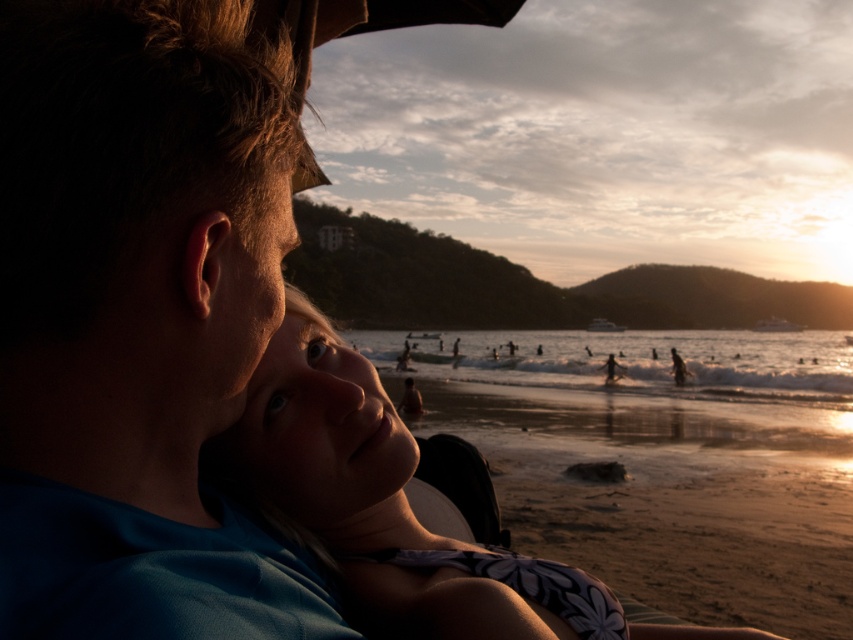
Question: Which point is farther to the camera?

Choices:
 (A) click(6, 170)
 (B) click(552, 579)

Answer: (B)

Question: Is blue fabric shirt at center closer to camera compared to smooth skin face at center?

Choices:
 (A) no
 (B) yes

Answer: (B)

Question: Which point is closer to the camera?

Choices:
 (A) (560, 593)
 (B) (144, 35)

Answer: (B)

Question: Where is blue fabric shirt at center located in relation to smooth skin face at center in the image?

Choices:
 (A) above
 (B) below

Answer: (A)

Question: Is blue fabric shirt at center above smooth skin face at center?

Choices:
 (A) yes
 (B) no

Answer: (A)

Question: Which of the following is the farthest from the observer?

Choices:
 (A) (267, 515)
 (B) (194, 289)

Answer: (A)